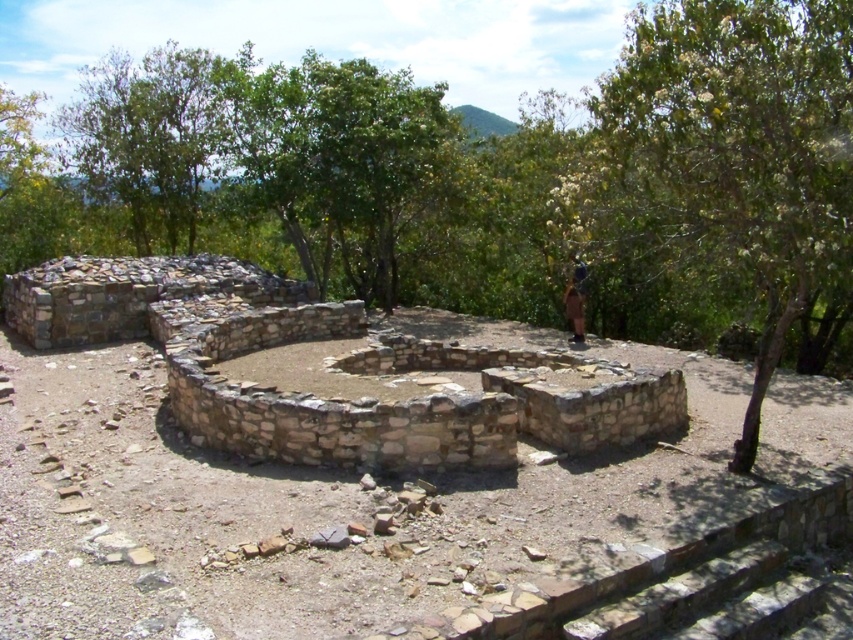
Is green leafy tree at upper right wider than brown fabric at center?

Yes.

Who is taller, green leafy tree at upper right or brown fabric at center?

green leafy tree at upper right

Is point (827, 198) closer to viewer compared to point (564, 308)?

Yes, it is.

Where is `green leafy tree at upper right`? green leafy tree at upper right is located at coordinates (738, 148).